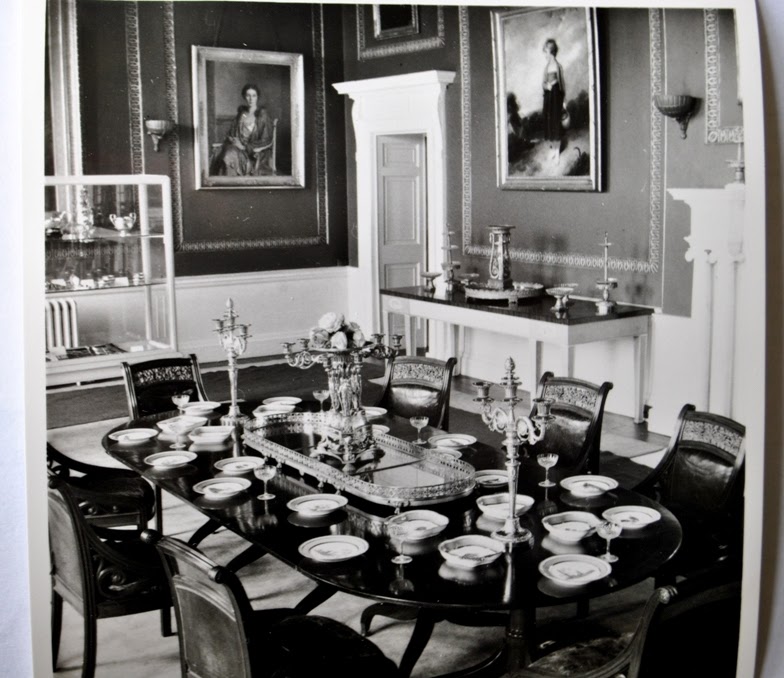
The width and height of the screenshot is (784, 678). I want to click on tray, so click(398, 487).